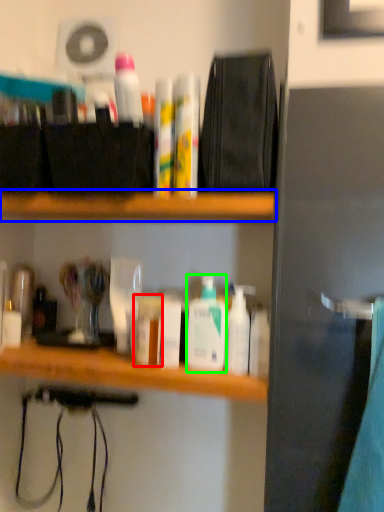
Question: Which object is positioned farthest from toiletry (highlighted by a red box)? Select from shelf (highlighted by a blue box) and toiletry (highlighted by a green box).

Choices:
 (A) shelf
 (B) toiletry

Answer: (A)